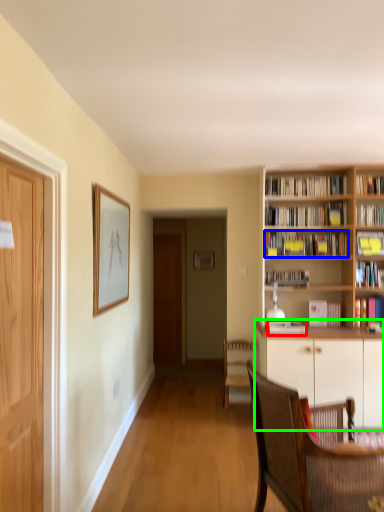
Question: Estimate the real-world distances between objects in this image. Which object is farther from book (highlighted by a red box), book (highlighted by a blue box) or cabinetry (highlighted by a green box)?

Choices:
 (A) book
 (B) cabinetry

Answer: (A)